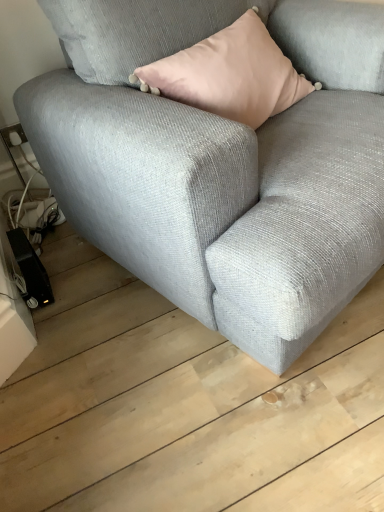
The image size is (384, 512). Find the location of `textured gray couch at center`. textured gray couch at center is located at coordinates (224, 168).

What do you see at coordinates (224, 168) in the screenshot? The width and height of the screenshot is (384, 512). I see `textured gray couch at center` at bounding box center [224, 168].

What is the approximate width of textured gray couch at center?

It is 1.01 meters.

Identify the location of textured gray couch at center. (224, 168).